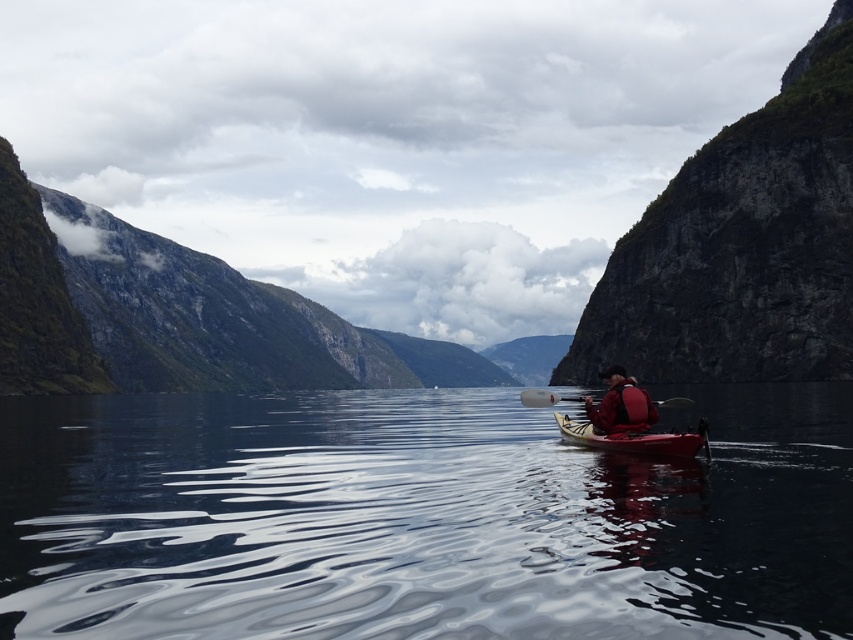
You are a photographer planning to take a picture of the red nylon jacket at center from your position near the camera. Given that the camera has a maximum focus range of 50 meters, will you be able to capture the jacket clearly?

The red nylon jacket at center and camera are 45.59 meters apart from each other. Since the distance is within the camera maximum focus range of 50 meters, you can capture the jacket clearly.

You are a photographer trying to capture the rugged stone cliff at right and the red nylon jacket at center in the same frame. Which object should you focus on first to ensure both are in the shot?

The rugged stone cliff at right is bigger than the red nylon jacket at center, so you should focus on the rugged stone cliff at right first to ensure both fit in the frame.